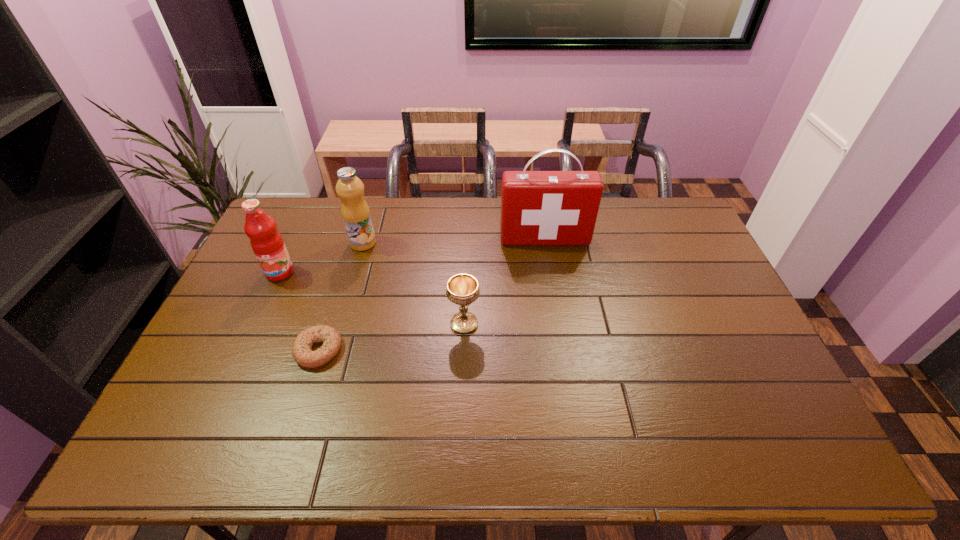
This screenshot has width=960, height=540. Find the location of `the first-aid kit`. the first-aid kit is located at coordinates (537, 207).

Where is `the tallest object`? the tallest object is located at coordinates (537, 207).

Where is `the farther fruit juice`? This screenshot has height=540, width=960. the farther fruit juice is located at coordinates (355, 211).

The image size is (960, 540). I want to click on the leftmost object, so click(x=266, y=241).

The width and height of the screenshot is (960, 540). I want to click on the left fruit juice, so click(266, 241).

Where is `the second object from right to left`? This screenshot has height=540, width=960. the second object from right to left is located at coordinates (462, 289).

Identify the location of chalice. This screenshot has height=540, width=960. (462, 289).

Where is `bagel`? Image resolution: width=960 pixels, height=540 pixels. bagel is located at coordinates (303, 355).

At what (x,y) coordinates should I click in order to perform the action: click on blank space located 0.310m on the front face of the tallest object. Please return your answer as a coordinate pair (x, y). The height and width of the screenshot is (540, 960). Looking at the image, I should click on (557, 317).

The height and width of the screenshot is (540, 960). I want to click on vacant space located 0.160m on the front label of the farther fruit juice, so click(x=421, y=243).